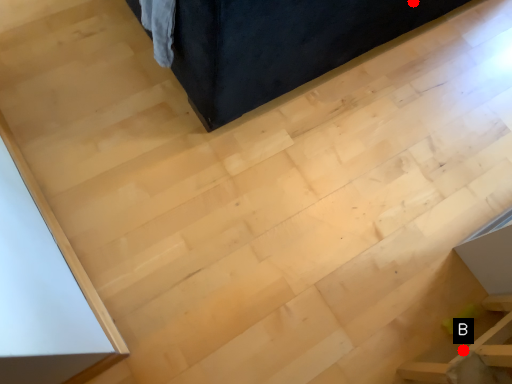
Question: Two points are circled on the image, labeled by A and B beside each circle. Among these points, which one is nearest to the camera?

Choices:
 (A) A is closer
 (B) B is closer

Answer: (B)